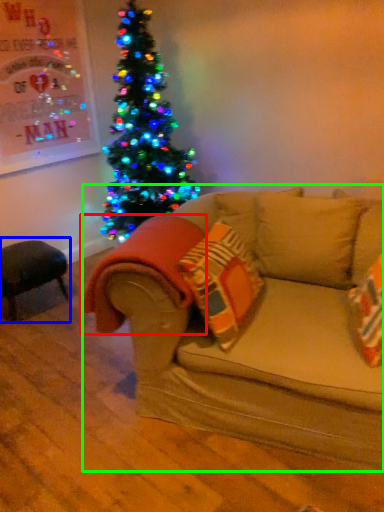
Question: Which is nearer to the blanket (highlighted by a red box)? swivel chair (highlighted by a blue box) or studio couch (highlighted by a green box).

Choices:
 (A) swivel chair
 (B) studio couch

Answer: (B)